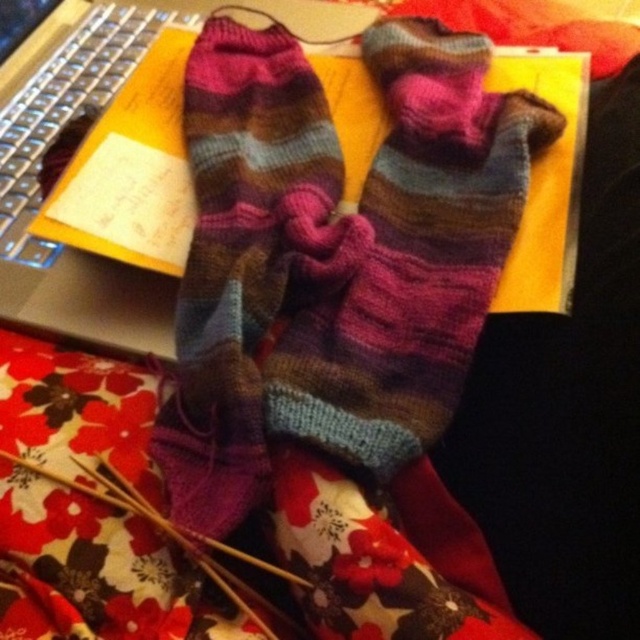
You are organizing a craft fair booth and need to display the multicolored knitted sock at center and the silver metallic laptop at upper left. The display shelf has a narrow section that can only accommodate items up to 5 cm in thickness. Which item should you place in the narrow section?

The multicolored knitted sock at center should be placed in the narrow section because it is thinner than the silver metallic laptop at upper left, making it suitable for the shelf space.

You are a delivery robot that needs to place a small package on the silver metallic keyboard at upper left without disturbing the multicolored knitted scarf at center. Given that the distance between them is 25.97 centimeters, can you safely move the package from the scarf to the keyboard?

The multicolored knitted scarf at center and silver metallic keyboard at upper left are 25.97 centimeters apart, so yes, the delivery robot can safely move the package from the scarf to the keyboard as there is sufficient space between them.

You are organizing your desk and want to move the multicolored knitted sock at center closer to the silver metallic keyboard at upper left. Which direction should you move the sock to place it next to the keyboard?

The multicolored knitted sock at center is currently to the right of the silver metallic keyboard at upper left. To move it closer, you should move it to the left so it aligns next to the keyboard.